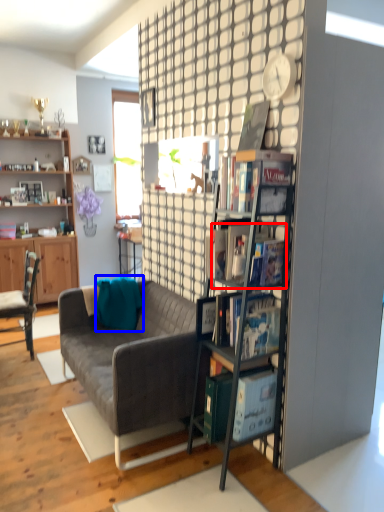
Question: Which of the following is the farthest to the observer, book (highlighted by a red box) or pillow (highlighted by a blue box)?

Choices:
 (A) book
 (B) pillow

Answer: (B)